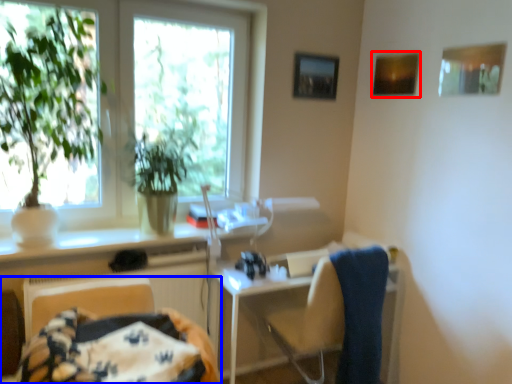
Question: Which point is further to the camera, picture frame (highlighted by a red box) or furniture (highlighted by a blue box)?

Choices:
 (A) picture frame
 (B) furniture

Answer: (A)